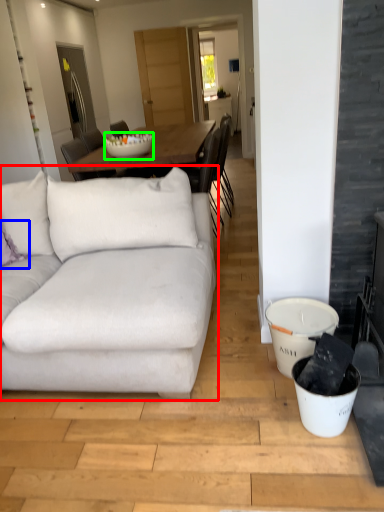
Question: Which object is the farthest from studio couch (highlighted by a red box)? Choose among these: pillow (highlighted by a blue box) or bowl (highlighted by a green box).

Choices:
 (A) pillow
 (B) bowl

Answer: (B)